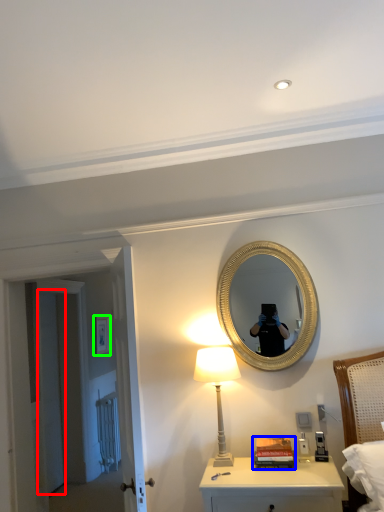
Question: Which object is the farthest from door (highlighted by a red box)? Choose among these: book (highlighted by a blue box) or picture frame (highlighted by a green box).

Choices:
 (A) book
 (B) picture frame

Answer: (A)